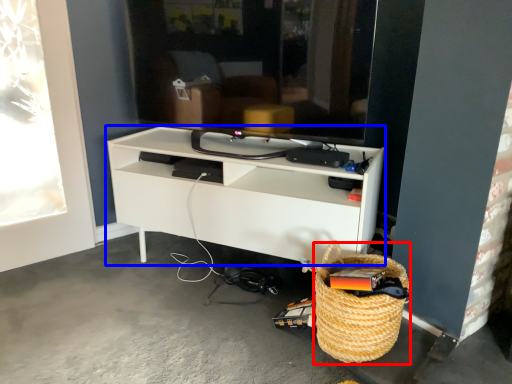
Question: Which object appears closest to the camera in this image, basket (highlighted by a red box) or shelf (highlighted by a blue box)?

Choices:
 (A) basket
 (B) shelf

Answer: (A)